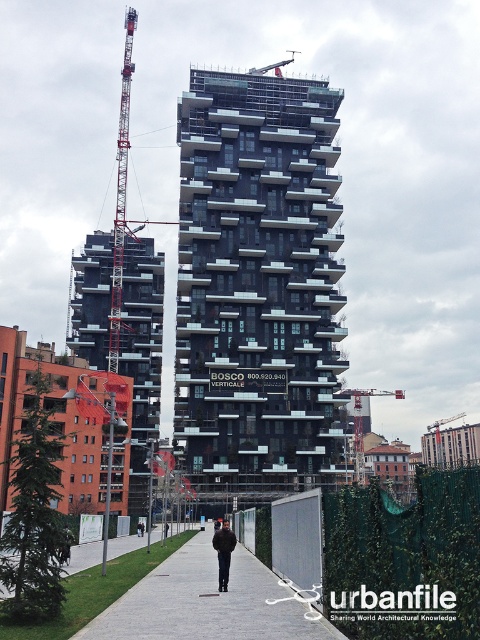
You are a construction worker standing on the gray concrete pavement at lower center and looking up at the metallic construction crane at center. Which object is taller?

The metallic construction crane at center is taller than the gray concrete pavement at lower center.

Consider the image. You are an architect reviewing the construction site layout. You notice the red metal crane at upper left and the black leather jacket at center. Which object is positioned more to the left side of the image?

The red metal crane at upper left is positioned more to the left side of the image than the black leather jacket at center.